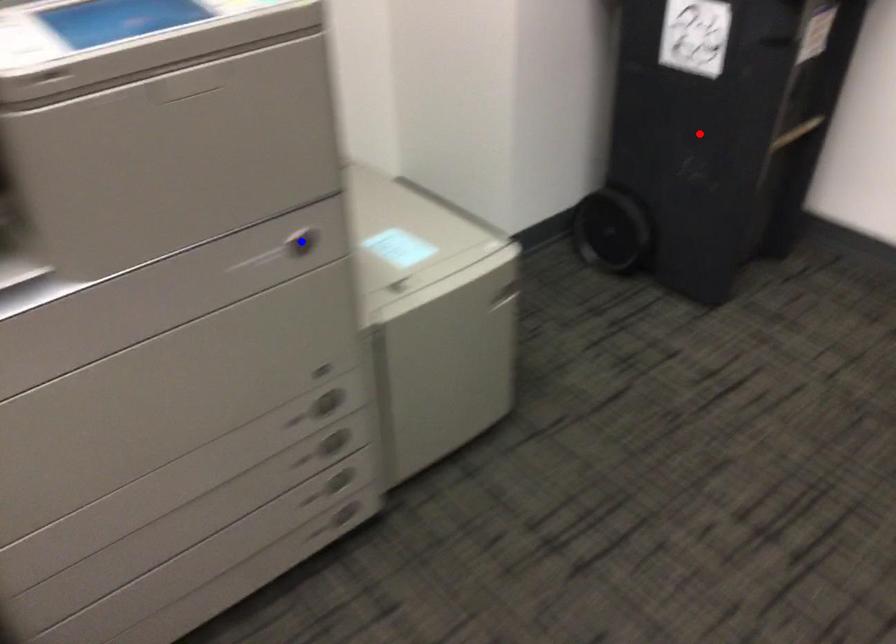
Question: In the image, two points are highlighted. Which point is nearer to the camera? Reply with the corresponding letter.

Choices:
 (A) blue point
 (B) red point

Answer: (A)